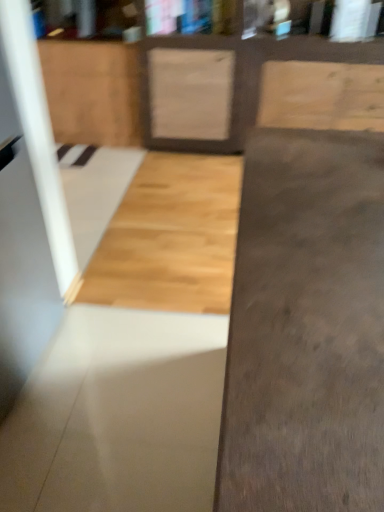
Question: From the image's perspective, relative to smooth concrete at center, the second concrete in the front-to-back sequence, is natural wood cabinet at upper left above or below?

Choices:
 (A) above
 (B) below

Answer: (A)

Question: In the image, is natural wood cabinet at upper left positioned in front of or behind smooth concrete at center, the second concrete in the front-to-back sequence?

Choices:
 (A) front
 (B) behind

Answer: (B)

Question: Which object is positioned farthest from the smooth concrete at center, the first concrete in the back-to-front sequence?

Choices:
 (A) natural wood cabinet at upper left
 (B) gray concrete at center, the 1th concrete from the front

Answer: (A)

Question: Estimate the real-world distances between objects in this image. Which object is closer to the smooth concrete at center, the second concrete in the front-to-back sequence?

Choices:
 (A) natural wood cabinet at upper left
 (B) gray concrete at center, the 1th concrete from the front

Answer: (B)